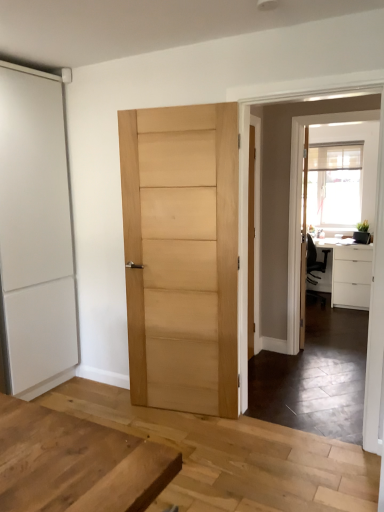
The width and height of the screenshot is (384, 512). I want to click on vacant area that is in front of clear glass screen door at upper right, so click(x=333, y=373).